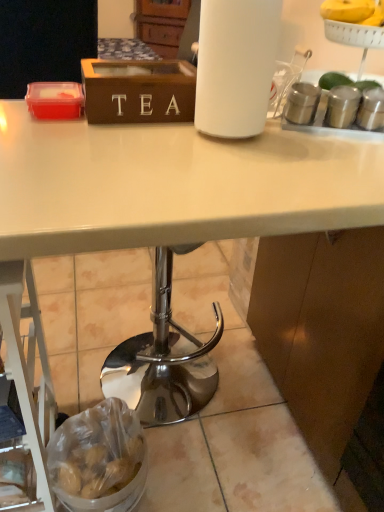
Measure the distance between wooden tea box at upper center and camera.

30.52 inches.

Measure the distance between point (137, 79) and camera.

Point (137, 79) is 32.28 inches from camera.

Identify the location of wooden tea box at upper center. The height and width of the screenshot is (512, 384). (138, 91).

This screenshot has width=384, height=512. What do you see at coordinates (138, 91) in the screenshot?
I see `wooden tea box at upper center` at bounding box center [138, 91].

Locate an element on the screen. Image resolution: width=384 pixels, height=512 pixels. translucent plastic bag of potatoes at lower left is located at coordinates (99, 459).

What do you see at coordinates (99, 459) in the screenshot? The width and height of the screenshot is (384, 512). I see `translucent plastic bag of potatoes at lower left` at bounding box center [99, 459].

Where is `wooden tea box at upper center`? The height and width of the screenshot is (512, 384). wooden tea box at upper center is located at coordinates (138, 91).

Visually, is translucent plastic bag of potatoes at lower left positioned to the left or to the right of wooden tea box at upper center?

Based on their positions, translucent plastic bag of potatoes at lower left is located to the left of wooden tea box at upper center.

Is the position of translucent plastic bag of potatoes at lower left less distant than that of wooden tea box at upper center?

No, the depth of translucent plastic bag of potatoes at lower left is greater than that of wooden tea box at upper center.

Which point is more forward, [125,462] or [119,110]?

The point [119,110] is closer to the camera.

From the image's perspective, is translucent plastic bag of potatoes at lower left on wooden tea box at upper center?

Actually, translucent plastic bag of potatoes at lower left appears below wooden tea box at upper center in the image.

From a real-world perspective, relative to wooden tea box at upper center, is translucent plastic bag of potatoes at lower left vertically above or below?

From a real-world perspective, translucent plastic bag of potatoes at lower left is physically below wooden tea box at upper center.

In terms of width, does translucent plastic bag of potatoes at lower left look wider or thinner when compared to wooden tea box at upper center?

In the image, translucent plastic bag of potatoes at lower left appears to be wider than wooden tea box at upper center.

Is translucent plastic bag of potatoes at lower left shorter than wooden tea box at upper center?

No.

Can you confirm if translucent plastic bag of potatoes at lower left is bigger than wooden tea box at upper center?

Indeed, translucent plastic bag of potatoes at lower left has a larger size compared to wooden tea box at upper center.

Consider the image. Is translucent plastic bag of potatoes at lower left spatially inside wooden tea box at upper center, or outside of it?

The correct answer is: outside.

Is translucent plastic bag of potatoes at lower left placed right next to wooden tea box at upper center?

translucent plastic bag of potatoes at lower left and wooden tea box at upper center are clearly separated.

Could you tell me if translucent plastic bag of potatoes at lower left is facing wooden tea box at upper center?

No, translucent plastic bag of potatoes at lower left is not oriented towards wooden tea box at upper center.

Find the location of a particular element. food that appears behind the wooden tea box at upper center is located at coordinates (99, 459).

Considering the relative positions of wooden tea box at upper center and translucent plastic bag of potatoes at lower left in the image provided, is wooden tea box at upper center to the left of translucent plastic bag of potatoes at lower left from the viewer's perspective?

No.

Is wooden tea box at upper center further to the viewer compared to translucent plastic bag of potatoes at lower left?

No, it is not.

Considering the positions of points (139, 61) and (66, 496), is point (139, 61) closer to camera compared to point (66, 496)?

No.

From the image's perspective, is wooden tea box at upper center positioned above or below translucent plastic bag of potatoes at lower left?

From the image's perspective, wooden tea box at upper center appears above translucent plastic bag of potatoes at lower left.

From a real-world perspective, is wooden tea box at upper center positioned above or below translucent plastic bag of potatoes at lower left?

In terms of real-world spatial position, wooden tea box at upper center is above translucent plastic bag of potatoes at lower left.

Between wooden tea box at upper center and translucent plastic bag of potatoes at lower left, which one has larger width?

translucent plastic bag of potatoes at lower left.

Considering the relative sizes of wooden tea box at upper center and translucent plastic bag of potatoes at lower left in the image provided, is wooden tea box at upper center shorter than translucent plastic bag of potatoes at lower left?

Indeed, wooden tea box at upper center has a lesser height compared to translucent plastic bag of potatoes at lower left.

Who is smaller, wooden tea box at upper center or translucent plastic bag of potatoes at lower left?

wooden tea box at upper center.

Is translucent plastic bag of potatoes at lower left completely or partially inside wooden tea box at upper center?

Definitely not — translucent plastic bag of potatoes at lower left is not inside wooden tea box at upper center.

Are wooden tea box at upper center and translucent plastic bag of potatoes at lower left beside each other?

No, wooden tea box at upper center is not with translucent plastic bag of potatoes at lower left.

Is wooden tea box at upper center turned away from translucent plastic bag of potatoes at lower left?

That's not correct — wooden tea box at upper center is not looking away from translucent plastic bag of potatoes at lower left.

Where is `food behind the wooden tea box at upper center`? This screenshot has width=384, height=512. food behind the wooden tea box at upper center is located at coordinates (99, 459).

The image size is (384, 512). What are the coordinates of `food on the left side of wooden tea box at upper center` in the screenshot? It's located at (99, 459).

I want to click on box on the right of translucent plastic bag of potatoes at lower left, so click(x=138, y=91).